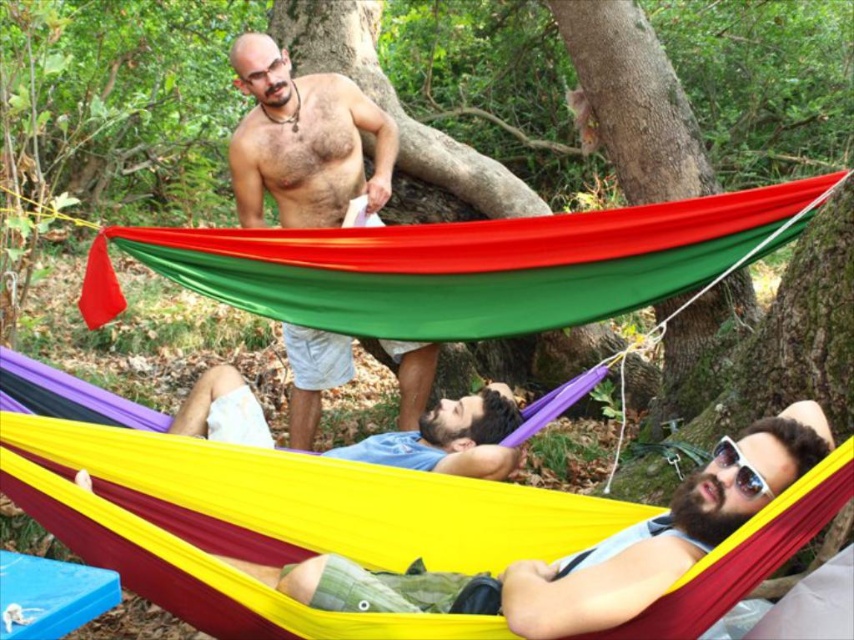
Question: Which point appears closest to the camera in this image?

Choices:
 (A) (259, 60)
 (B) (230, 397)

Answer: (B)

Question: Is blue cotton shirt at lower center thinner than sunglasses at center?

Choices:
 (A) yes
 (B) no

Answer: (B)

Question: Which of the following is the farthest from the observer?

Choices:
 (A) sunglasses at center
 (B) blue cotton shirt at lower center

Answer: (B)

Question: Which is farther from the yellow/red fabric hammock at lower center?

Choices:
 (A) blue cotton shirt at lower center
 (B) shiny silver necklace at upper center

Answer: (B)

Question: Does shiny silver necklace at upper center lie in front of sunglasses at center?

Choices:
 (A) no
 (B) yes

Answer: (A)

Question: Is shiny silver necklace at upper center positioned in front of sunglasses at center?

Choices:
 (A) yes
 (B) no

Answer: (B)